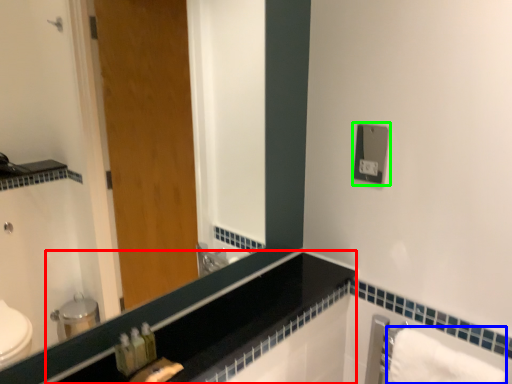
Question: Which is farther away from counter top (highlighted by a red box)? bath towel (highlighted by a blue box) or electric outlet (highlighted by a green box)?

Choices:
 (A) bath towel
 (B) electric outlet

Answer: (B)